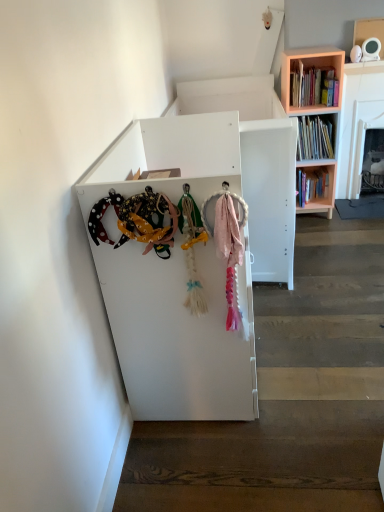
You are a GUI agent. You are given a task and a screenshot of the screen. Output one action in this format:
    pyautogui.click(x=<x>, y=<y>)
    Task: Click on the free space above pink fabric at lower right (from a real-world perspective)
    The width and height of the screenshot is (384, 512).
    Given the screenshot: What is the action you would take?
    pyautogui.click(x=326, y=295)